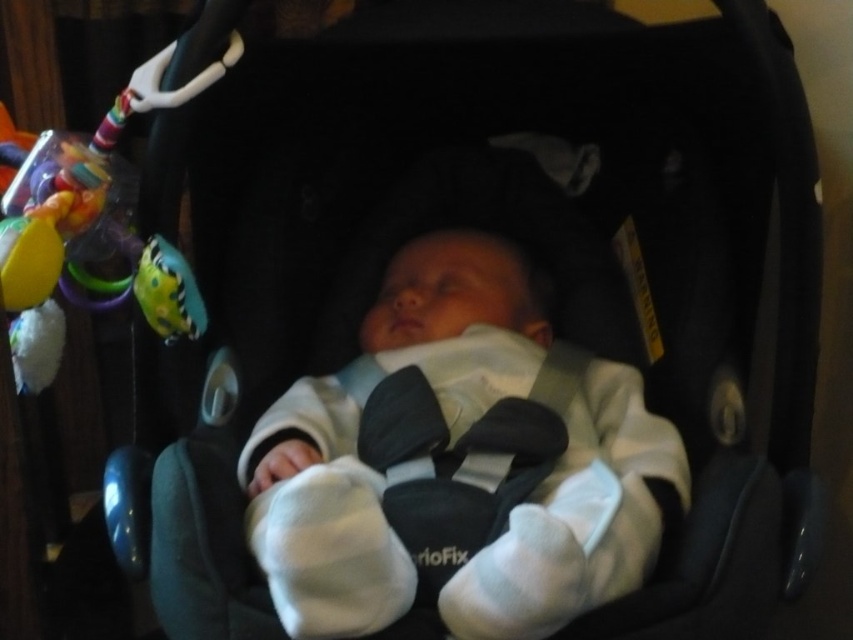
Question: Does white soft baby at center come behind rubberized green and yellow toy at left?

Choices:
 (A) yes
 (B) no

Answer: (B)

Question: Is white soft baby at center above rubberized green and yellow toy at left?

Choices:
 (A) yes
 (B) no

Answer: (B)

Question: Can you confirm if white soft baby at center is wider than rubberized green and yellow toy at left?

Choices:
 (A) yes
 (B) no

Answer: (A)

Question: Among these objects, which one is nearest to the camera?

Choices:
 (A) rubberized green and yellow toy at left
 (B) white soft baby at center

Answer: (B)

Question: Which point is farther from the camera taking this photo?

Choices:
 (A) (402, 605)
 (B) (155, 324)

Answer: (B)